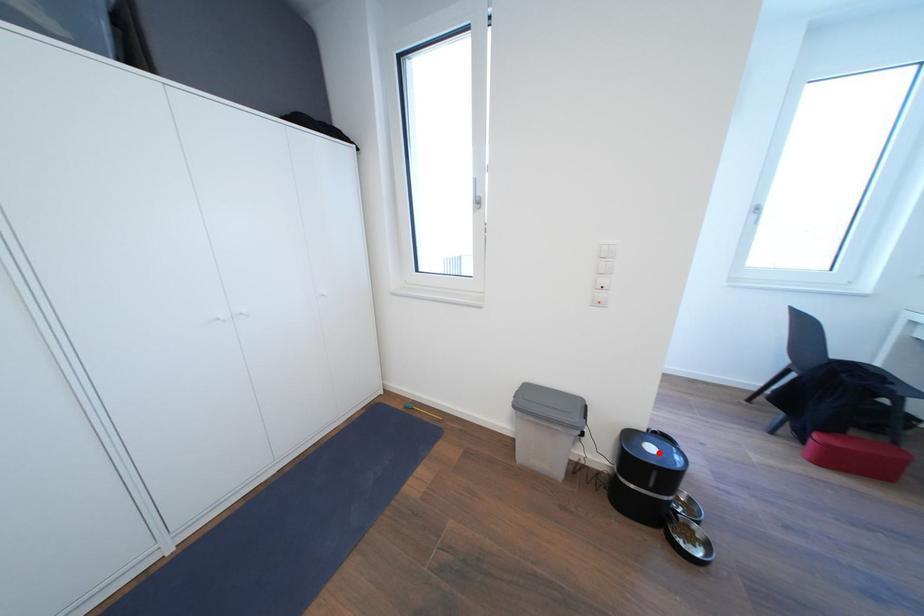
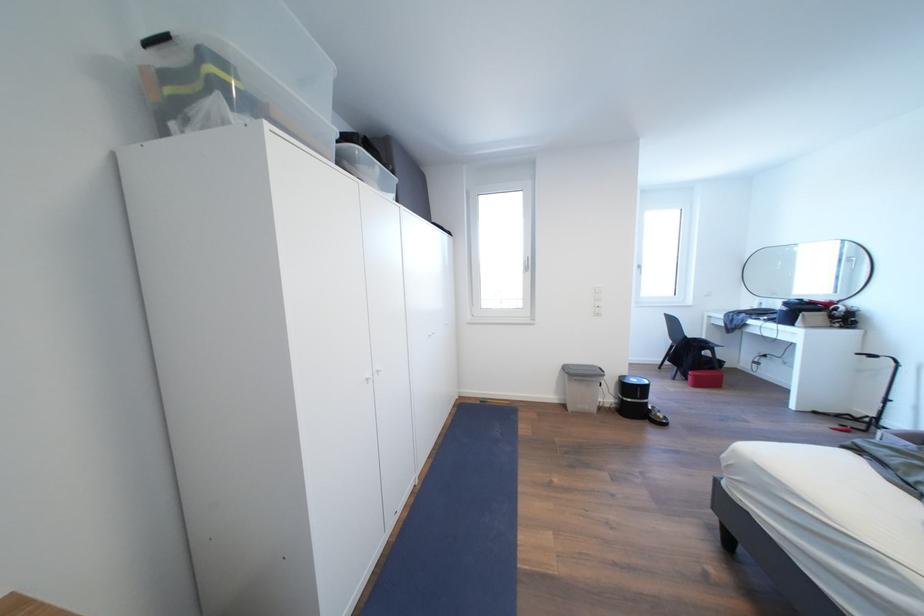
Question: I am providing you with two images of the same scene from different viewpoints. Given a red point in image1, look at the same physical point in image2. Is it:

Choices:
 (A) Closer to the viewpoint
 (B) Farther from the viewpoint

Answer: (B)